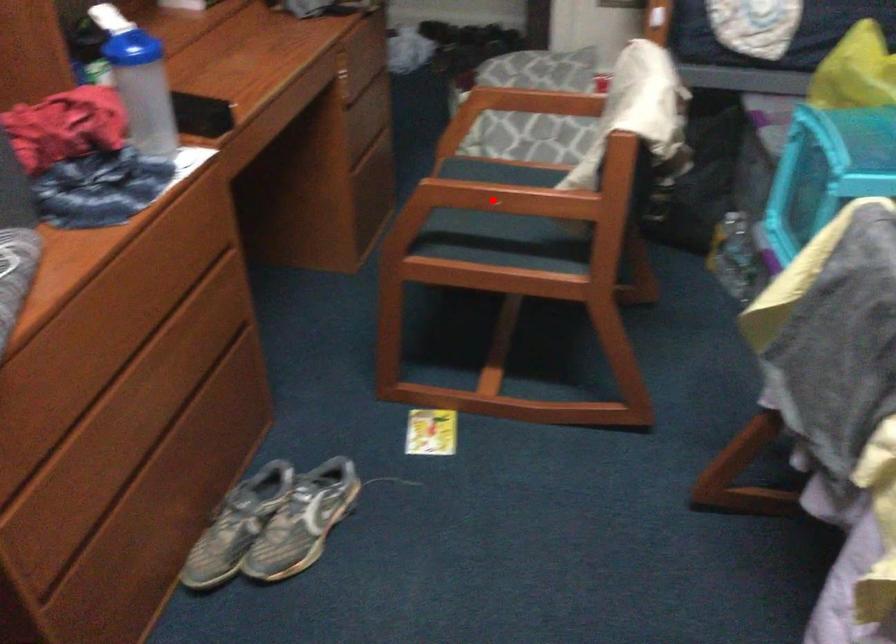
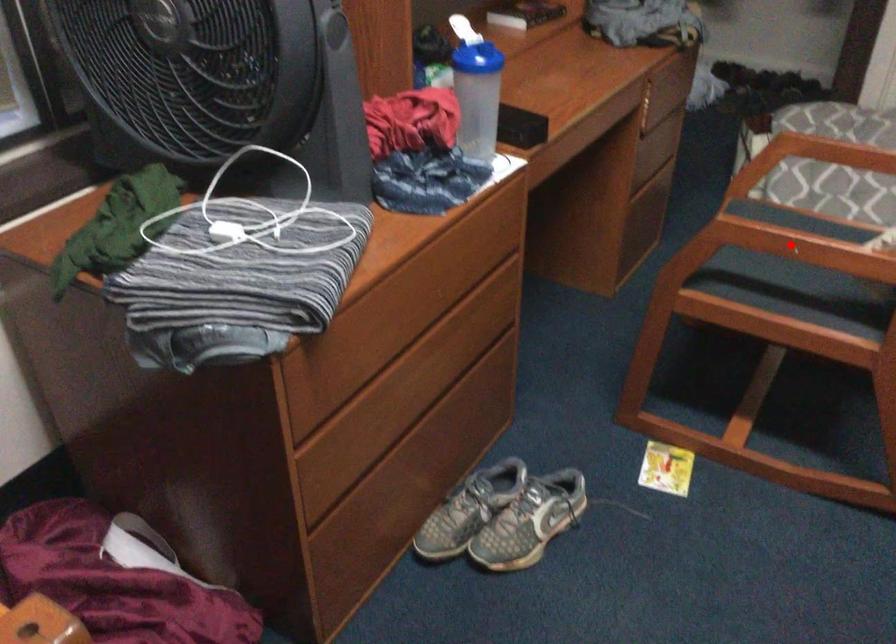
I am providing you with two images of the same scene from different viewpoints. A red point is marked on the first image and another point is marked on the second image. Do the highlighted points in image1 and image2 indicate the same real-world spot?

Yes